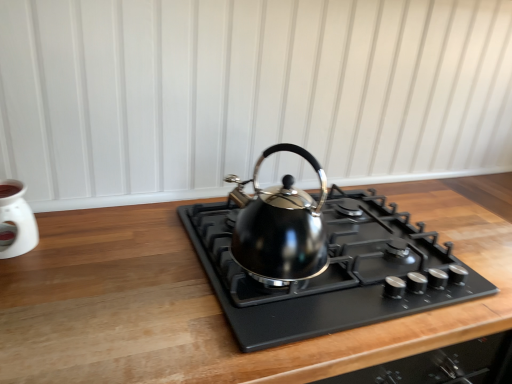
Find the location of a particular element. The width and height of the screenshot is (512, 384). vacant space situated on the left part of black metallic kettle at center is located at coordinates coord(165,274).